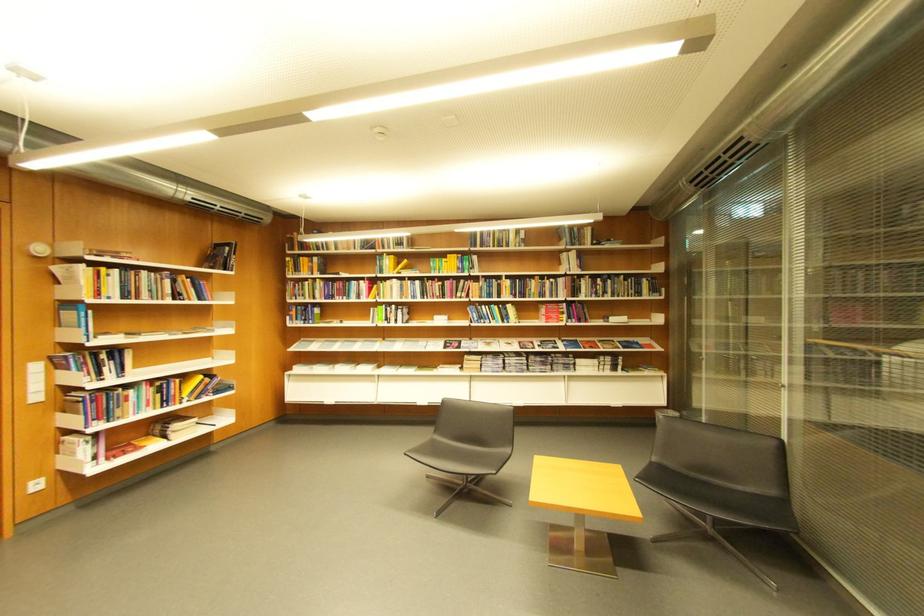
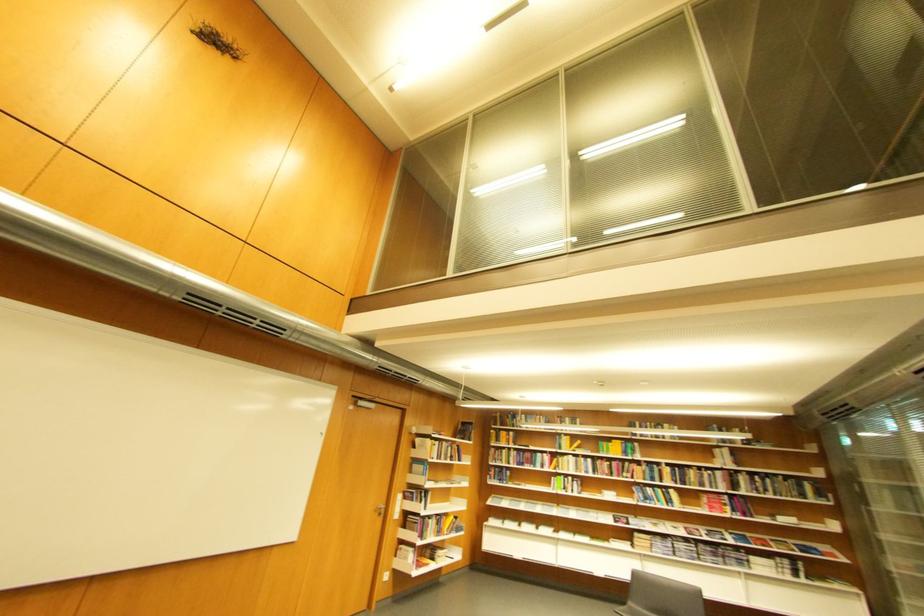
Question: I am providing you with two images of the same scene from different viewpoints. After the viewpoint changes to image2, which objects are now occluded?

Choices:
 (A) silver door handle
 (B) grey chair sitting surface
 (C) bookshelf book
 (D) none of these

Answer: (D)